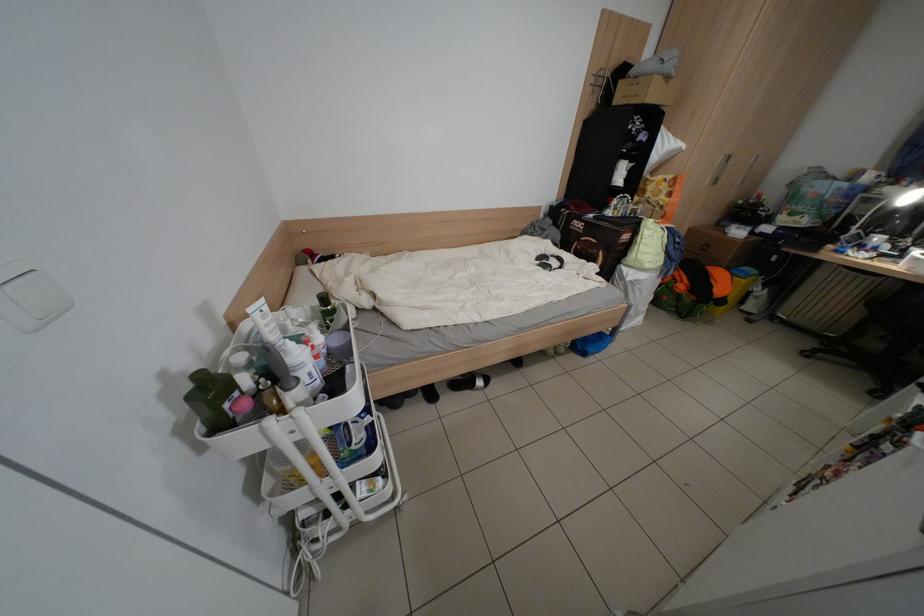
You are a GUI agent. You are given a task and a screenshot of the screen. Output one action in this format:
    pyautogui.click(x=<x>, y=<y>)
    Task: Click on the bottle pump
    
    Given the screenshot: What is the action you would take?
    pyautogui.click(x=285, y=345)